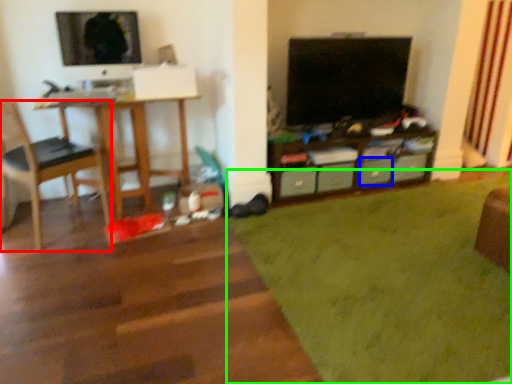
Question: Considering the real-world distances, which object is closest to chair (highlighted by a red box)? drawer (highlighted by a blue box) or plain (highlighted by a green box).

Choices:
 (A) drawer
 (B) plain

Answer: (B)